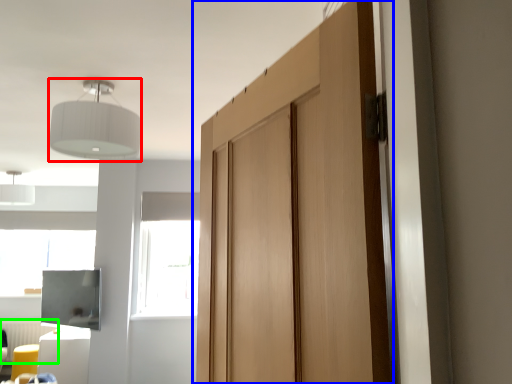
Question: Which object is the closest to the light fixture (highlighted by a red box)? Choose among these: door (highlighted by a blue box) or radiator (highlighted by a green box).

Choices:
 (A) door
 (B) radiator

Answer: (A)